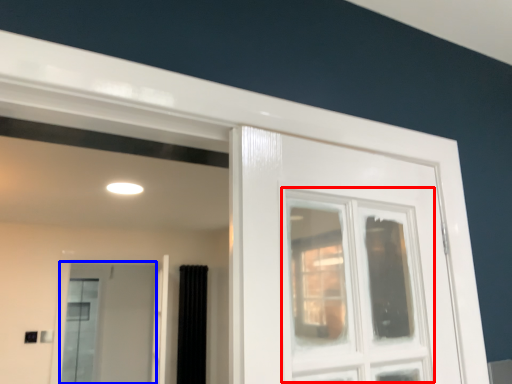
Question: Which point is further to the camera, window (highlighted by a red box) or screen door (highlighted by a blue box)?

Choices:
 (A) window
 (B) screen door

Answer: (B)